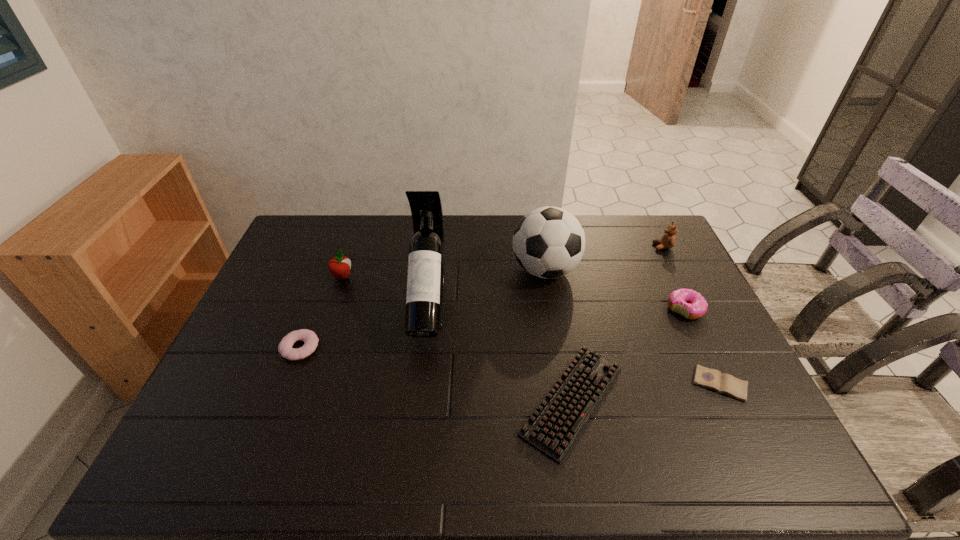
I want to click on diary, so click(713, 379).

Where is `free location located 0.230m on the stand of the sixth object from right to left`? free location located 0.230m on the stand of the sixth object from right to left is located at coordinates (414, 434).

You are a GUI agent. You are given a task and a screenshot of the screen. Output one action in this format:
    pyautogui.click(x=<x>, y=<y>)
    Task: Click on the vacant space located on the right of the soccer ball
    This screenshot has width=960, height=540.
    Given the screenshot: What is the action you would take?
    pyautogui.click(x=603, y=270)

This screenshot has height=540, width=960. In order to click on vacant space located 0.320m on the face of the teddy bear in this screenshot , I will do `click(564, 247)`.

Locate an element on the screen. free region located on the face of the teddy bear is located at coordinates (603, 247).

You are a GUI agent. You are given a task and a screenshot of the screen. Output one action in this format:
    pyautogui.click(x=<x>, y=<y>)
    Task: Click on the free space located 0.170m on the face of the teddy bear
    
    Given the screenshot: What is the action you would take?
    click(606, 247)

Where is `vacant space located on the back of the apple`? This screenshot has width=960, height=540. vacant space located on the back of the apple is located at coordinates (348, 260).

Find the location of `blank space located 0.220m on the left of the taller doughnut`. blank space located 0.220m on the left of the taller doughnut is located at coordinates (594, 309).

The image size is (960, 540). What are the coordinates of `vacant space located on the front of the nearer doughnut` in the screenshot? It's located at (261, 448).

Locate an element on the screen. The height and width of the screenshot is (540, 960). free space located 0.380m on the back of the computer keyboard is located at coordinates (548, 261).